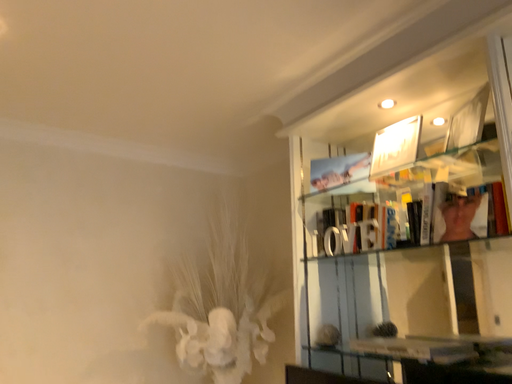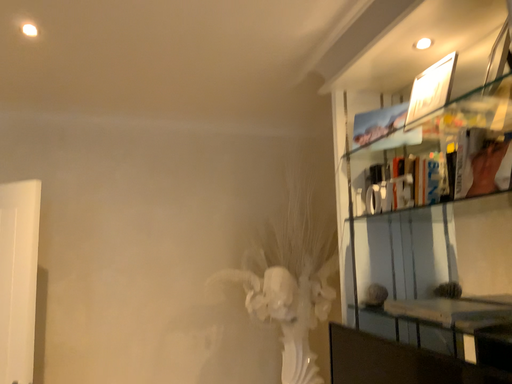
Question: How did the camera likely rotate when shooting the video?

Choices:
 (A) rotated downward
 (B) rotated upward

Answer: (A)